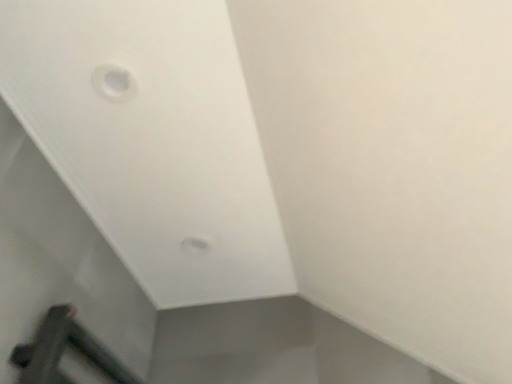
What do you see at coordinates (195, 245) in the screenshot? Image resolution: width=512 pixels, height=384 pixels. I see `white matte hole at center` at bounding box center [195, 245].

Locate an element on the screen. This screenshot has width=512, height=384. white matte hole at center is located at coordinates coord(195,245).

In order to click on white matte hole at center in this screenshot , I will do `click(195, 245)`.